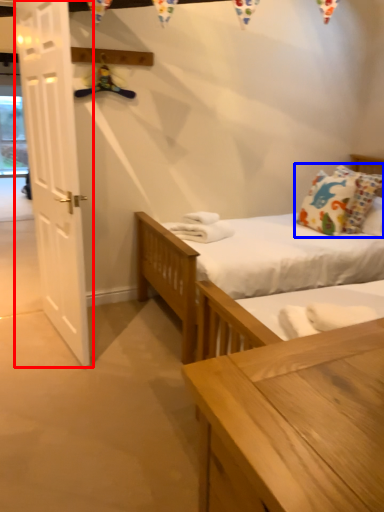
Question: Among these objects, which one is farthest to the camera, door (highlighted by a red box) or pillow (highlighted by a blue box)?

Choices:
 (A) door
 (B) pillow

Answer: (B)